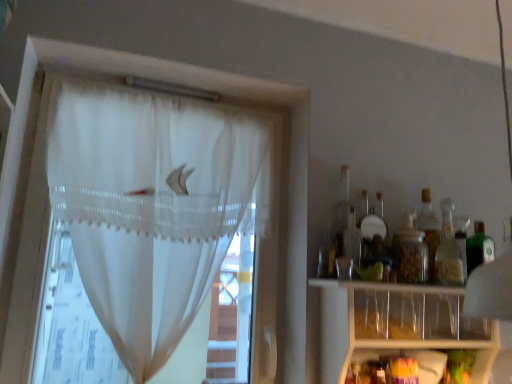
Question: Looking at the image, does translucent glass bottle at right, positioned as the 1th bottle in right-to-left order, seem bigger or smaller compared to white sheer curtain at left?

Choices:
 (A) big
 (B) small

Answer: (B)

Question: From the image's perspective, is translucent glass bottle at right, positioned as the 1th bottle in right-to-left order, above or below white sheer curtain at left?

Choices:
 (A) above
 (B) below

Answer: (B)

Question: Which of these objects is positioned closest to the white sheer curtain at left?

Choices:
 (A) clear plastic shelf at lower right
 (B) translucent glass bottle at right, positioned as the 1th bottle in right-to-left order
 (C) transparent glass jar at right, the first bottle in the left-to-right sequence

Answer: (A)

Question: Which of these objects is positioned farthest from the transparent glass jar at right, the second bottle positioned from the right?

Choices:
 (A) white sheer curtain at left
 (B) clear plastic shelf at lower right
 (C) translucent glass bottle at right, positioned as the 1th bottle in right-to-left order

Answer: (A)